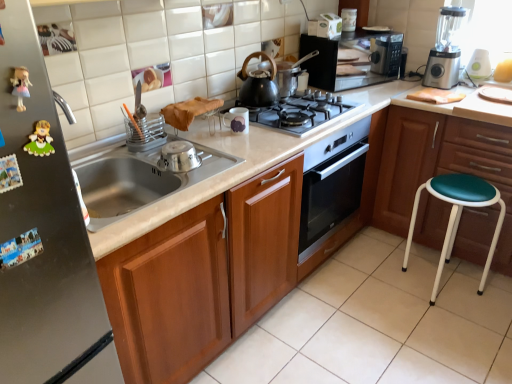
What are the coordinates of `vacant space in teal vinyl stool at lower right (from a real-world perspective)` in the screenshot? It's located at (434, 275).